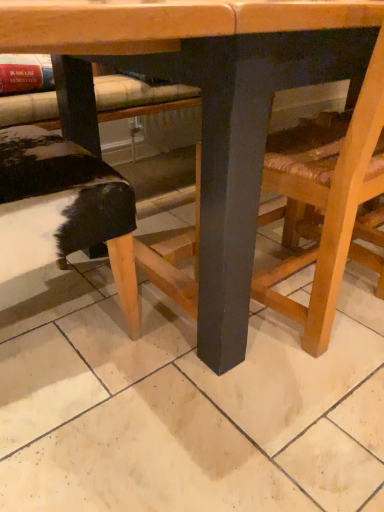
Find the location of a particular element. The width and height of the screenshot is (384, 512). free space in front of black furry cushion at lower left is located at coordinates (82, 439).